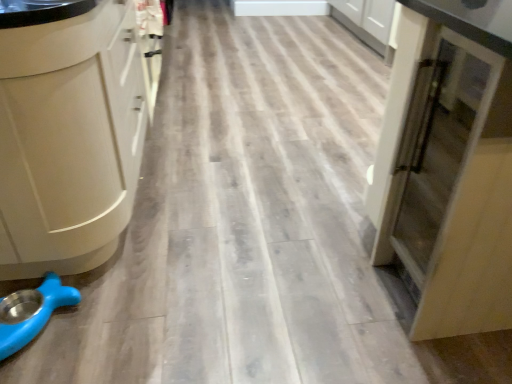
Question: Considering the relative sizes of blue rubber pet bowl at lower left and matte white cabinet at left in the image provided, is blue rubber pet bowl at lower left smaller than matte white cabinet at left?

Choices:
 (A) no
 (B) yes

Answer: (B)

Question: Can you confirm if blue rubber pet bowl at lower left is shorter than matte white cabinet at left?

Choices:
 (A) yes
 (B) no

Answer: (A)

Question: From the image's perspective, is blue rubber pet bowl at lower left above matte white cabinet at left?

Choices:
 (A) no
 (B) yes

Answer: (A)

Question: Is blue rubber pet bowl at lower left to the left of matte white cabinet at left from the viewer's perspective?

Choices:
 (A) yes
 (B) no

Answer: (B)

Question: Does blue rubber pet bowl at lower left have a lesser width compared to matte white cabinet at left?

Choices:
 (A) no
 (B) yes

Answer: (B)

Question: Is blue rubber pet bowl at lower left outside of matte white cabinet at left?

Choices:
 (A) yes
 (B) no

Answer: (A)

Question: From the image's perspective, is matte white cabinet at left below blue rubber pet bowl at lower left?

Choices:
 (A) no
 (B) yes

Answer: (A)

Question: Considering the relative positions of matte white cabinet at left and blue rubber pet bowl at lower left in the image provided, is matte white cabinet at left to the right of blue rubber pet bowl at lower left from the viewer's perspective?

Choices:
 (A) no
 (B) yes

Answer: (A)

Question: From the image's perspective, is matte white cabinet at left located above blue rubber pet bowl at lower left?

Choices:
 (A) no
 (B) yes

Answer: (B)

Question: Is matte white cabinet at left bigger than blue rubber pet bowl at lower left?

Choices:
 (A) yes
 (B) no

Answer: (A)

Question: From a real-world perspective, is matte white cabinet at left on top of blue rubber pet bowl at lower left?

Choices:
 (A) no
 (B) yes

Answer: (B)

Question: Is matte white cabinet at left next to blue rubber pet bowl at lower left?

Choices:
 (A) yes
 (B) no

Answer: (B)

Question: Can you confirm if blue rubber pet bowl at lower left is wider than matte wood cupboard at right?

Choices:
 (A) no
 (B) yes

Answer: (A)